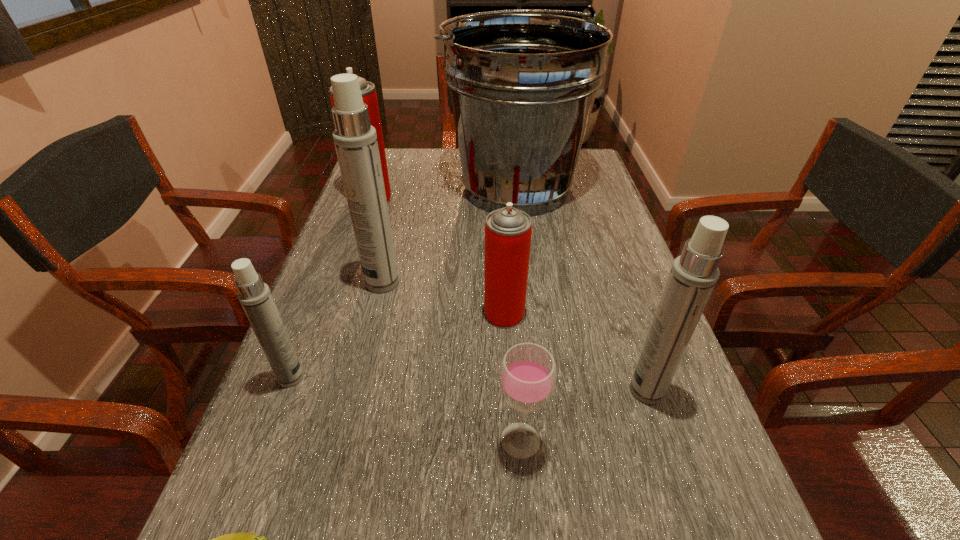
This screenshot has width=960, height=540. Find the location of `vacant position in the image that satisfies the following two spatial constraints: 1. on the front side of the seventh farthest object; 2. on the right side of the second aerosol can from right to left`. vacant position in the image that satisfies the following two spatial constraints: 1. on the front side of the seventh farthest object; 2. on the right side of the second aerosol can from right to left is located at coordinates (512, 440).